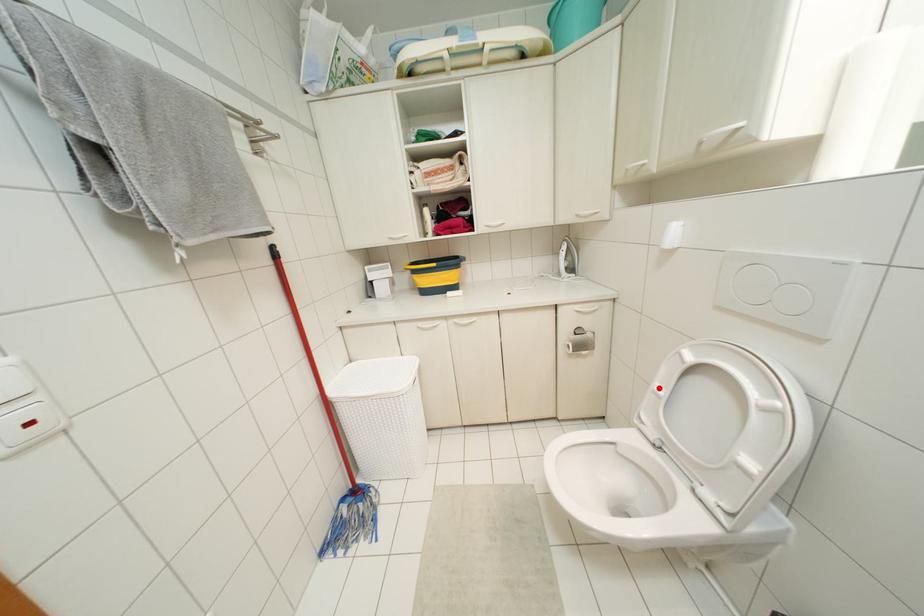
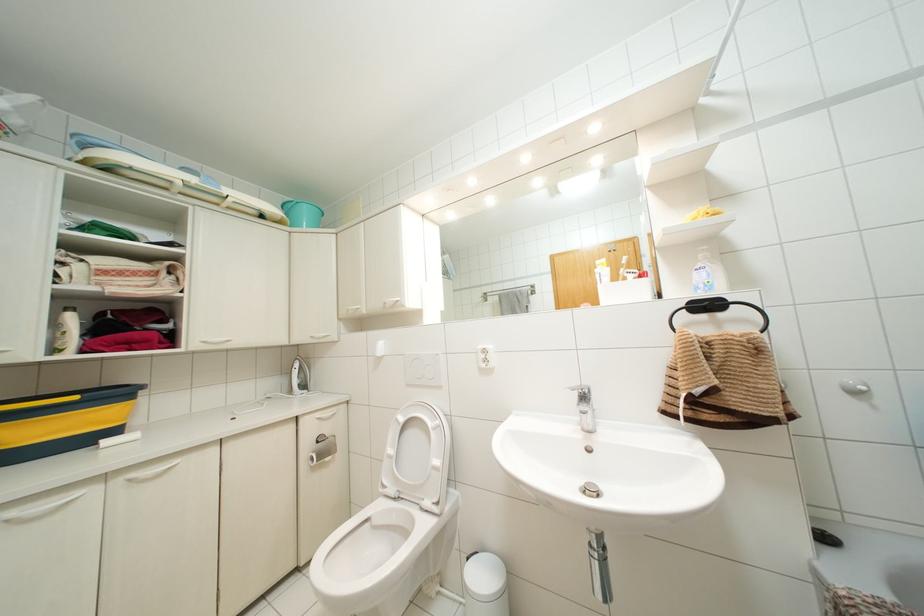
Question: I am providing you with two images of the same scene from different viewpoints. Image1 has a red point marked. In image2, the corresponding 3D location appears at what relative position? Reply with the corresponding letter.

Choices:
 (A) Closer
 (B) Farther

Answer: (B)